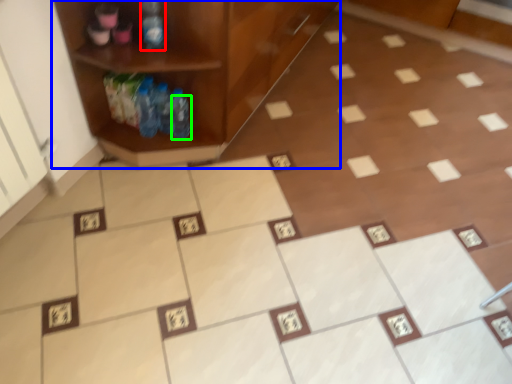
Question: Which object is positioned closest to bottle (highlighted by a red box)? Select from shelf (highlighted by a blue box) and bottle (highlighted by a green box).

Choices:
 (A) shelf
 (B) bottle

Answer: (A)